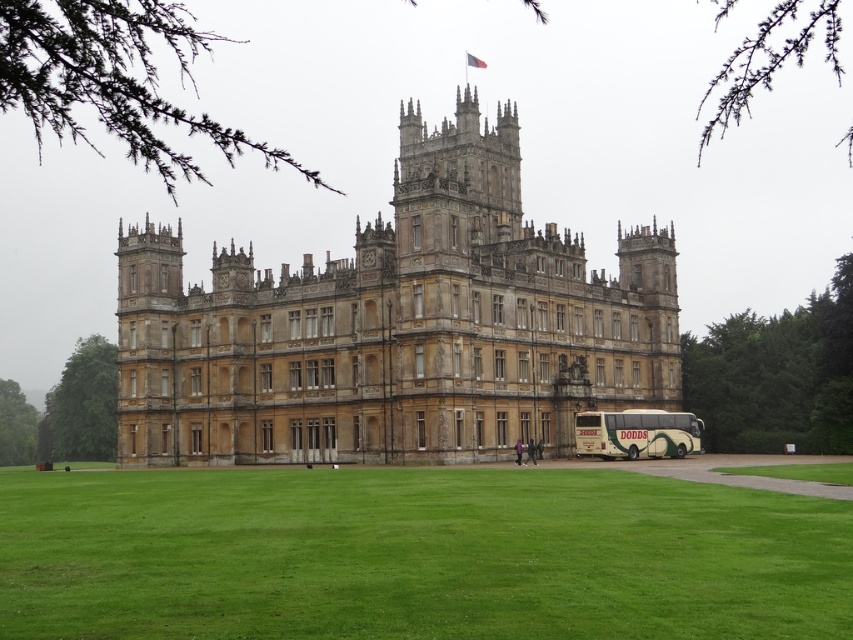
Between point (824, 573) and point (648, 413), which one is positioned in front?

Point (824, 573) is more forward.

Which is behind, point (561, 472) or point (657, 412)?

The point (657, 412) is behind.

Where is `green grass at lower center`? green grass at lower center is located at coordinates (415, 556).

Between green grass at lower center and golden stone castle at center, which one is positioned lower?

green grass at lower center

Is green grass at lower center to the right of golden stone castle at center from the viewer's perspective?

No, green grass at lower center is not to the right of golden stone castle at center.

Who is more distant from viewer, (585, 513) or (438, 300)?

The point (438, 300) is more distant.

Where is `green grass at lower center`? The width and height of the screenshot is (853, 640). green grass at lower center is located at coordinates (415, 556).

Can you confirm if golden stone castle at center is wider than beige textured bus at lower right?

Yes, golden stone castle at center is wider than beige textured bus at lower right.

This screenshot has width=853, height=640. Describe the element at coordinates (396, 326) in the screenshot. I see `golden stone castle at center` at that location.

Is point (282, 380) less distant than point (648, 452)?

No, it is not.

Image resolution: width=853 pixels, height=640 pixels. I want to click on golden stone castle at center, so click(396, 326).